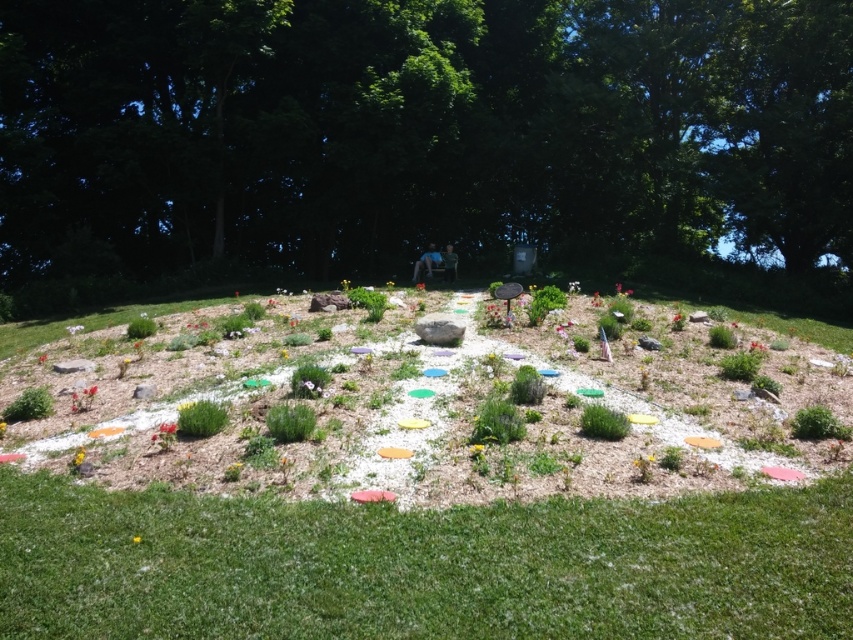
Question: Among these objects, which one is nearest to the camera?

Choices:
 (A) green grass at lower center
 (B) green leafy tree at center

Answer: (A)

Question: Which point is closer to the camera?

Choices:
 (A) green leafy tree at center
 (B) green grass at lower center

Answer: (B)

Question: Does green leafy tree at center have a lesser width compared to green grass at lower center?

Choices:
 (A) no
 (B) yes

Answer: (A)

Question: Which object is farther from the camera taking this photo?

Choices:
 (A) green leafy tree at center
 (B) green grass at lower center

Answer: (A)

Question: Can you confirm if green leafy tree at center is positioned to the right of green grass at lower center?

Choices:
 (A) no
 (B) yes

Answer: (B)

Question: Is the position of green leafy tree at center less distant than that of green grass at lower center?

Choices:
 (A) yes
 (B) no

Answer: (B)